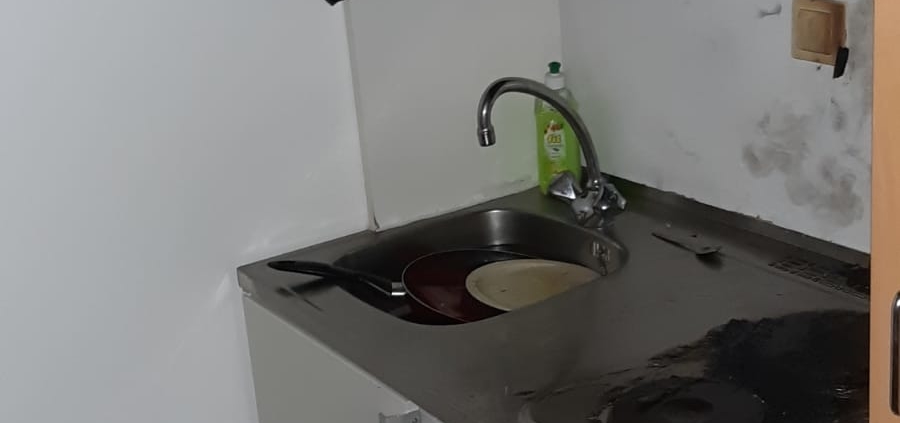
Where is `faucet`? The height and width of the screenshot is (423, 900). faucet is located at coordinates (590, 164).